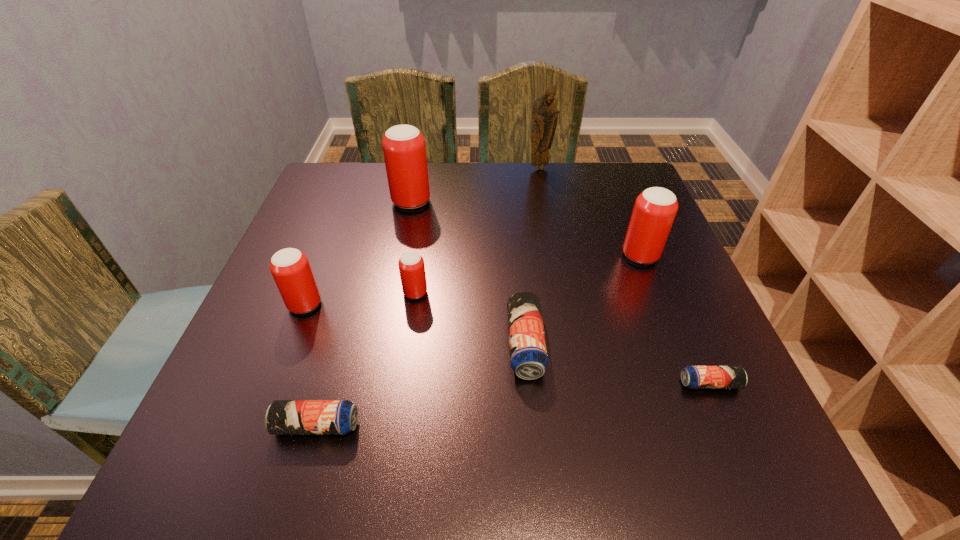
At what (x,y) coordinates should I click in order to perform the action: click on vacant point located on the right of the fifth tallest object. Please return your answer as a coordinate pair (x, y). The width and height of the screenshot is (960, 540). Looking at the image, I should click on (604, 293).

You are a GUI agent. You are given a task and a screenshot of the screen. Output one action in this format:
    pyautogui.click(x=<x>, y=<y>)
    Task: Click on the vacant space located 0.060m on the left of the second blue beer can from left to right
    The height and width of the screenshot is (540, 960).
    Given the screenshot: What is the action you would take?
    pyautogui.click(x=476, y=345)

Find the location of a particular element. The height and width of the screenshot is (540, 960). vacant area situated on the back of the sixth tallest beer can is located at coordinates [349, 311].

Identify the location of free space located on the back of the shortest object. (667, 286).

The width and height of the screenshot is (960, 540). I want to click on figurine located in the far edge section of the desktop, so click(545, 114).

Locate an element on the screen. This screenshot has height=540, width=960. beer can situated at the far edge is located at coordinates (404, 149).

Find the location of a particular element. The width and height of the screenshot is (960, 540). object at the near edge is located at coordinates (283, 417).

Image resolution: width=960 pixels, height=540 pixels. I want to click on object present at the near left corner, so click(283, 417).

The width and height of the screenshot is (960, 540). In order to click on blank area at the far edge in this screenshot , I will do `click(562, 205)`.

This screenshot has width=960, height=540. Identify the location of free space at the left edge of the desktop. (328, 212).